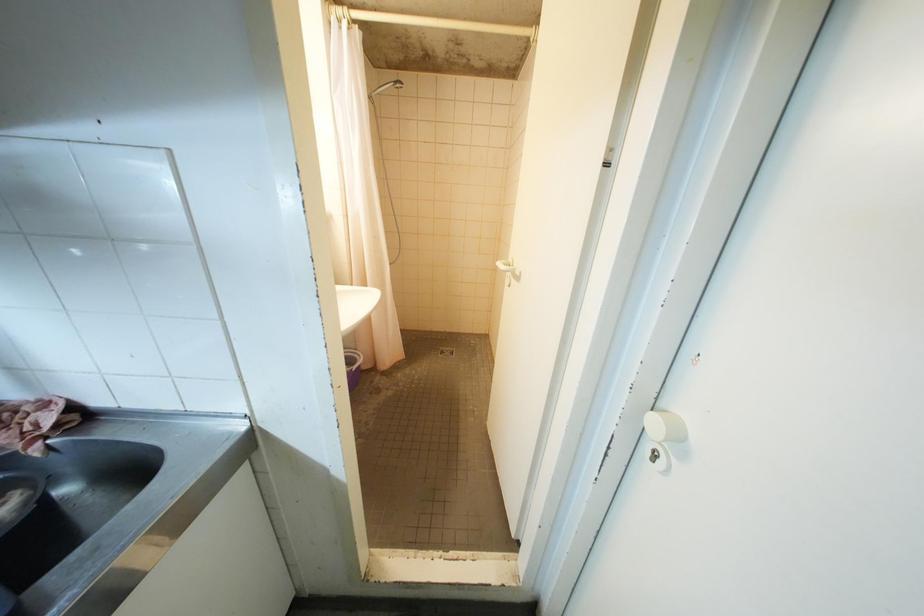
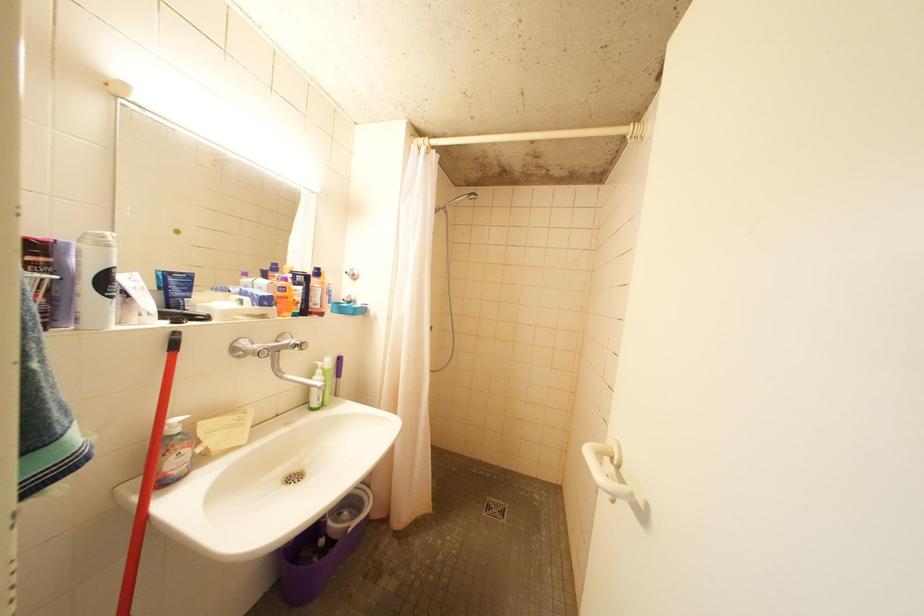
From the picture: How did the camera likely rotate?

The camera rotated toward left-up.